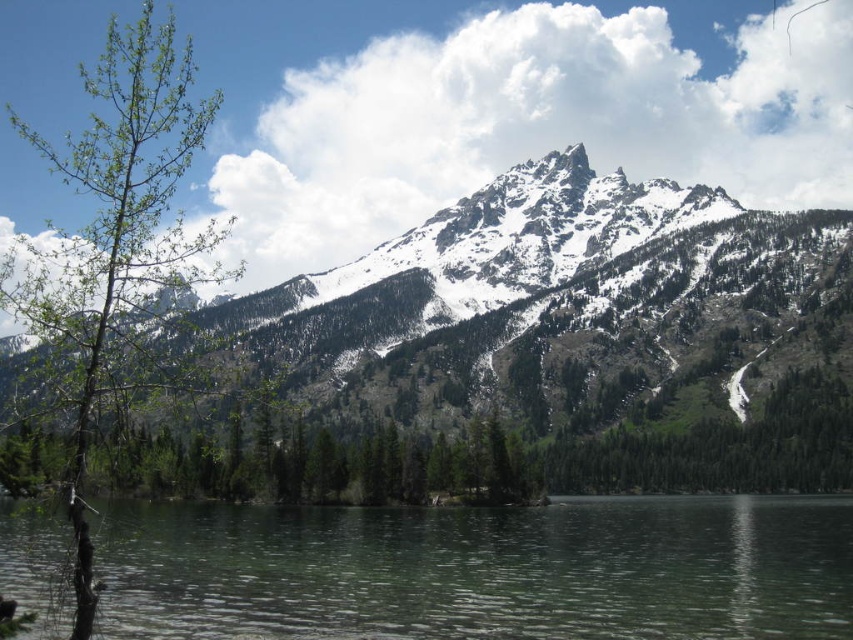
You are a hiker who wants to cross the clear water at center to reach the green leafy tree at left. Can you safely walk across the water?

The clear water at center is 184.10 meters from the green leafy tree at left, so the distance is too large to safely walk across the water.

You are standing at the edge of the lake in the scene. If you look towards the point labeled as point [480,570], what would you see there?

You would see clear water at center at point [480,570].

You are an outdoor photographer planning to capture the snowy rocky mountain at center and the green leafy tree at left in a single shot. Based on their positions, which object will appear closer to you in the photo?

The snowy rocky mountain at center will appear closer to you in the photo because it is positioned further to the viewer than the green leafy tree at left, making it seem nearer in the image.